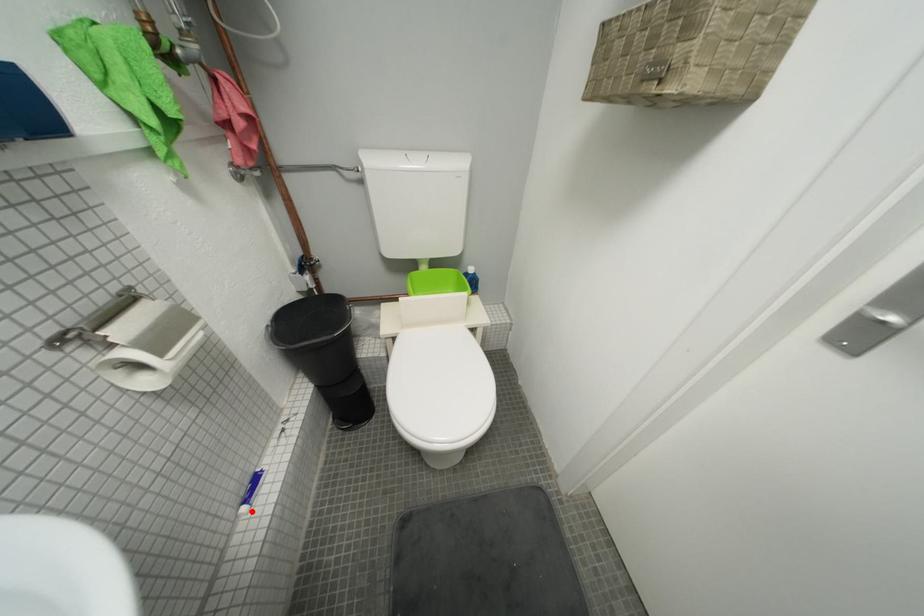
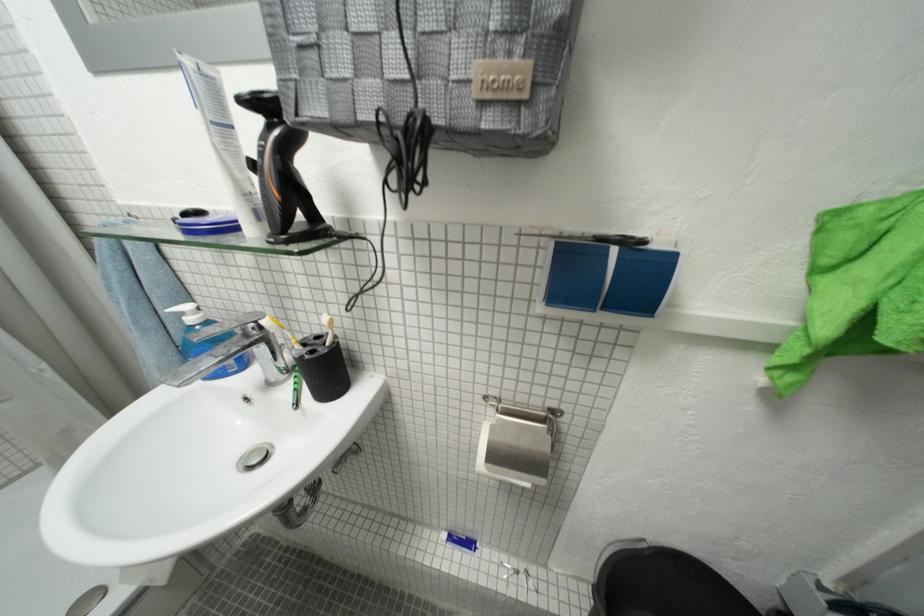
Question: I am providing you with two images of the same scene from different viewpoints. Given a red point in image1, look at the same physical point in image2. Is it:

Choices:
 (A) Closer to the viewpoint
 (B) Farther from the viewpoint

Answer: (B)